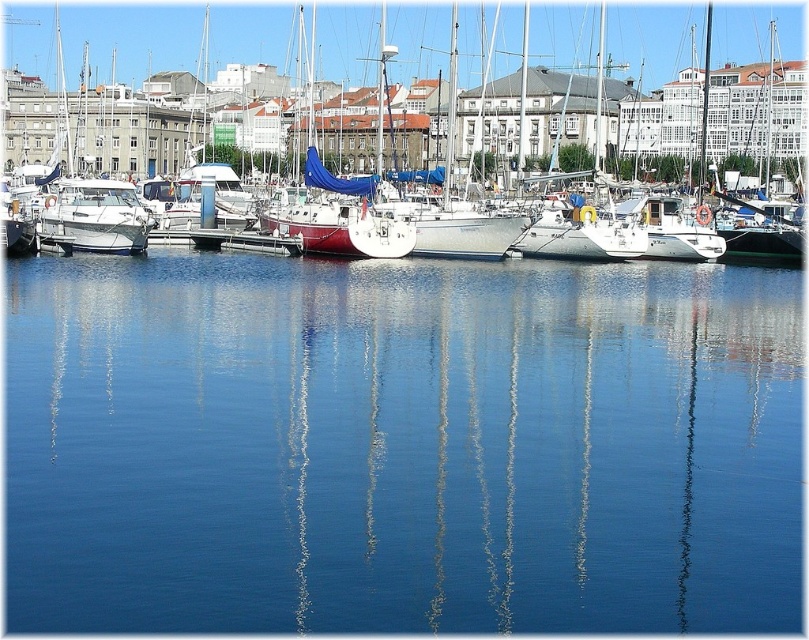
Question: Which of the following is the closest to the observer?

Choices:
 (A) blue smooth water at center
 (B) white matte sailboat at center
 (C) white glossy boat at left

Answer: (A)

Question: Is blue smooth water at center wider than white glossy boat at left?

Choices:
 (A) yes
 (B) no

Answer: (A)

Question: Does blue smooth water at center have a lesser width compared to white matte sailboat at center?

Choices:
 (A) yes
 (B) no

Answer: (A)

Question: Which of these objects is positioned farthest from the white matte sailboat at center?

Choices:
 (A) white wood dock at center
 (B) white glossy boat at left

Answer: (B)

Question: Can you confirm if blue smooth water at center is bigger than white wood dock at center?

Choices:
 (A) no
 (B) yes

Answer: (B)

Question: Among these points, which one is farthest from the camera?

Choices:
 (A) (71, 212)
 (B) (184, 17)
 (C) (198, 241)

Answer: (B)